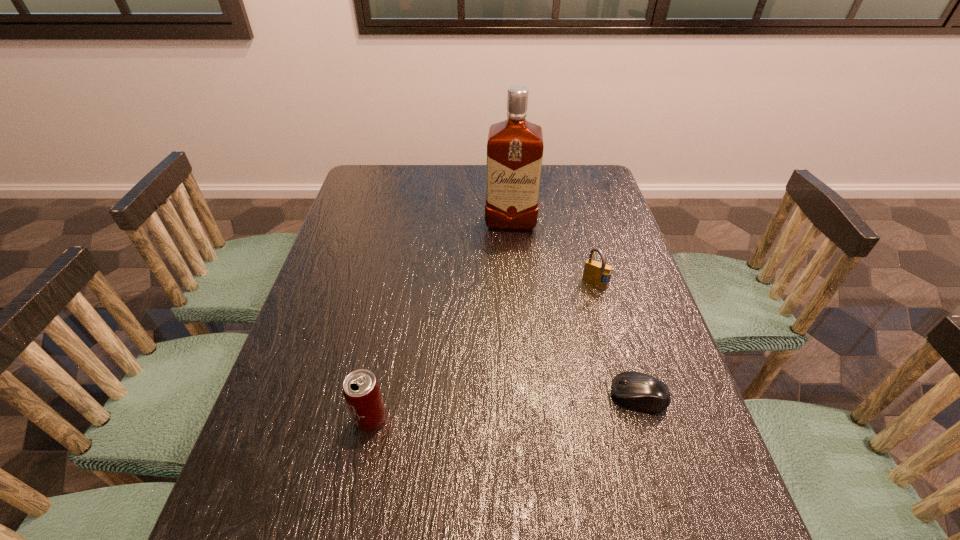
You are a GUI agent. You are given a task and a screenshot of the screen. Output one action in this format:
    pyautogui.click(x=<x>, y=<y>)
    Task: Click on the vacant space in between the mouse and the second farthest object
    
    Given the screenshot: What is the action you would take?
    pyautogui.click(x=617, y=340)

You are a GUI agent. You are given a task and a screenshot of the screen. Output one action in this format:
    pyautogui.click(x=<x>, y=<y>)
    Task: Click on the object that can be found as the second closest to the farthest object
    Image resolution: width=960 pixels, height=540 pixels.
    Given the screenshot: What is the action you would take?
    pyautogui.click(x=638, y=390)

Locate an element on the screen. Image resolution: width=960 pixels, height=540 pixels. object that is the second closest to the mouse is located at coordinates (361, 390).

Locate an element on the screen. free location that satisfies the following two spatial constraints: 1. on the back side of the second farthest object; 2. on the left side of the beer can is located at coordinates (397, 283).